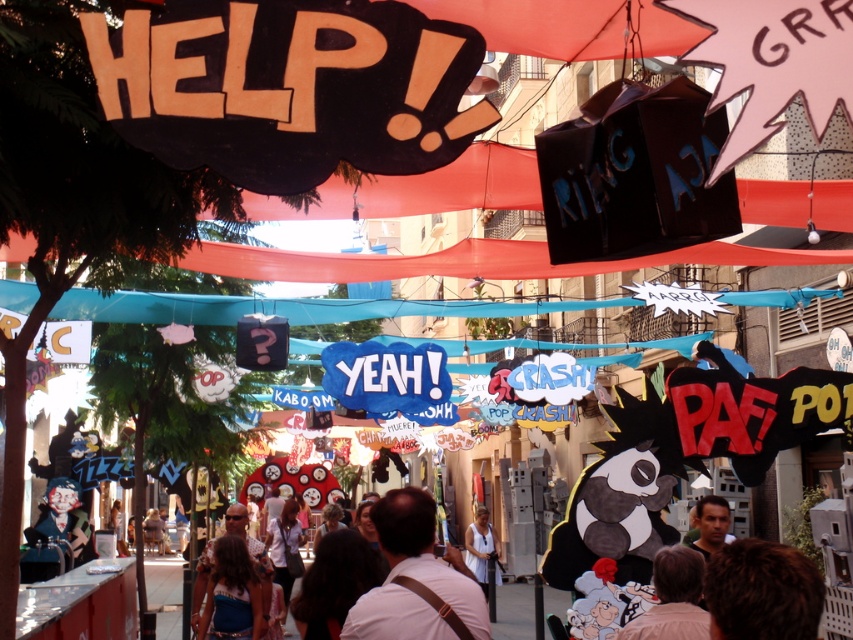
Question: Which point is closer to the camera taking this photo?

Choices:
 (A) (705, 516)
 (B) (80, 538)

Answer: (A)

Question: From the image, what is the correct spatial relationship of white matte shirt at center in relation to light brown hair at center?

Choices:
 (A) below
 (B) above

Answer: (A)

Question: Which object is farther from the camera taking this photo?

Choices:
 (A) smooth skin face at center
 (B) brown hair at lower right
 (C) light brown hair at center
 (D) white fabric dress at center

Answer: (D)

Question: Which is farther from the white matte shirt at center?

Choices:
 (A) white fabric dress at center
 (B) brown hair at lower right
 (C) matte clown mask at lower left

Answer: (C)

Question: Can you confirm if white matte shirt at center is bigger than brown hair at lower right?

Choices:
 (A) no
 (B) yes

Answer: (B)

Question: Can you confirm if light brown hair at center is wider than smooth skin face at center?

Choices:
 (A) no
 (B) yes

Answer: (B)